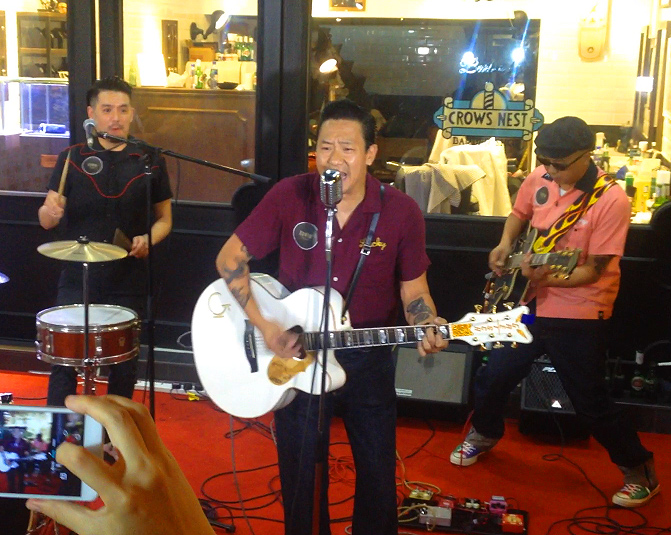
This screenshot has width=671, height=535. I want to click on door, so click(258, 91).